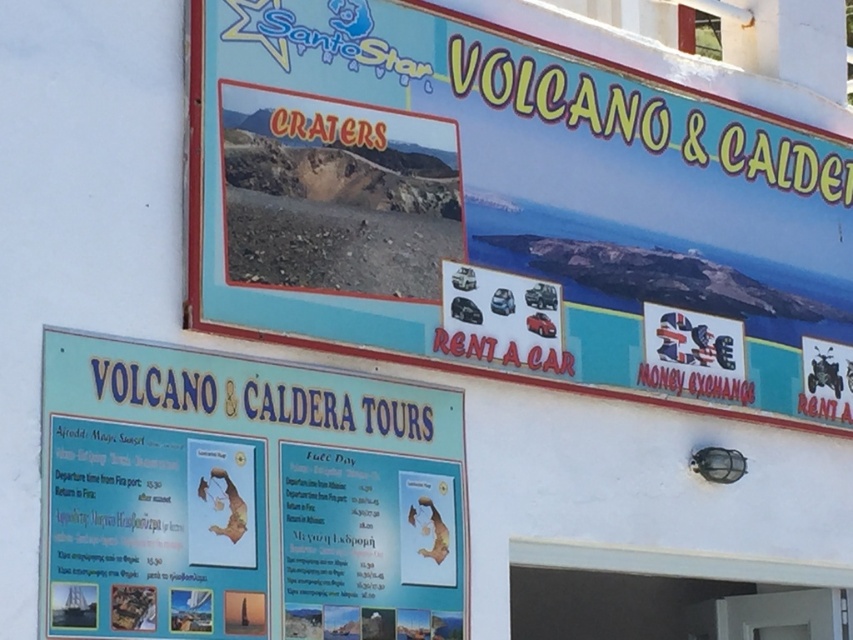
Does blue plastic signboard at upper center lie in front of blue paperboard sign at lower center?

No, blue plastic signboard at upper center is further to the viewer.

Consider the image. Which is more to the left, blue plastic signboard at upper center or blue paperboard sign at lower center?

From the viewer's perspective, blue paperboard sign at lower center appears more on the left side.

What are the coordinates of `blue plastic signboard at upper center` in the screenshot? It's located at (517, 211).

Identify the location of blue plastic signboard at upper center. (517, 211).